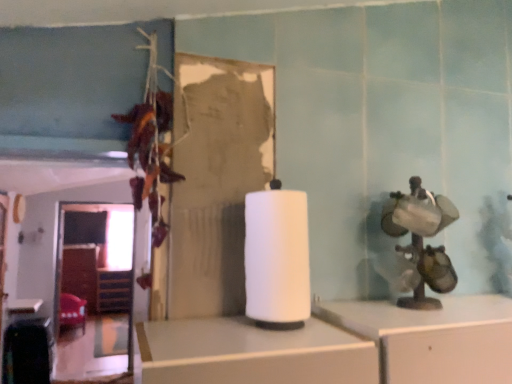
Question: Considering the positions of velvet red chair at lower left and white matte paper towel at center in the image, is velvet red chair at lower left wider or thinner than white matte paper towel at center?

Choices:
 (A) wide
 (B) thin

Answer: (A)

Question: From the image's perspective, is velvet red chair at lower left located above or below white matte paper towel at center?

Choices:
 (A) below
 (B) above

Answer: (A)

Question: Which object is positioned closest to the white matte paper towel at center?

Choices:
 (A) white glossy table at lower left
 (B) wooden at left
 (C) velvet red chair at lower left

Answer: (A)

Question: Estimate the real-world distances between objects in this image. Which object is farther from the velvet red chair at lower left?

Choices:
 (A) white matte paper towel at center
 (B) white glossy table at lower left
 (C) wooden at left

Answer: (A)